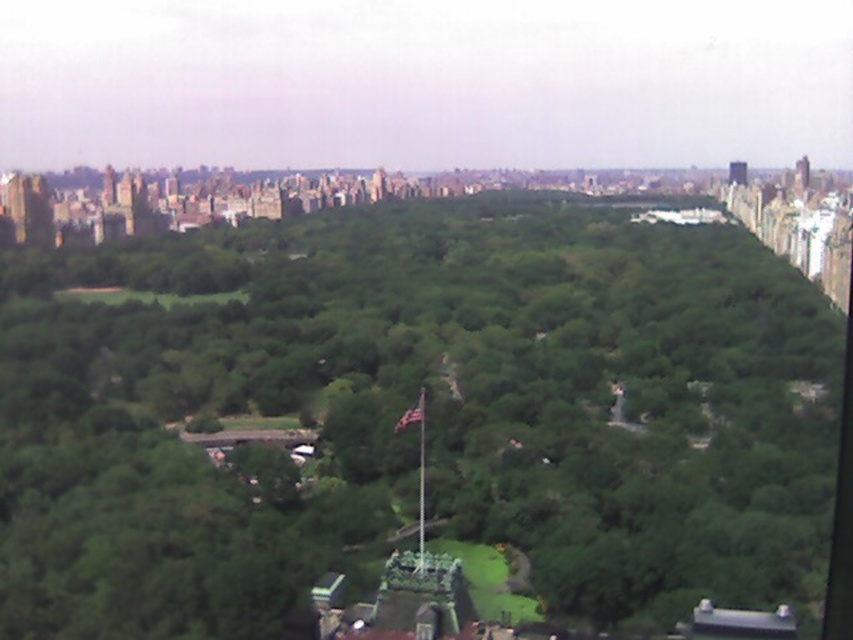
Question: Can you confirm if dark gray stone tower at upper right is positioned below smooth glass tower at upper right?

Choices:
 (A) no
 (B) yes

Answer: (A)

Question: Can you confirm if dark gray stone tower at upper right is positioned below smooth glass tower at upper right?

Choices:
 (A) yes
 (B) no

Answer: (B)

Question: Which object is closer to the camera taking this photo?

Choices:
 (A) green leafy trees at center
 (B) dark gray stone tower at upper right
 (C) smooth glass tower at upper right

Answer: (A)

Question: Which object is farther from the camera taking this photo?

Choices:
 (A) dark gray stone tower at upper right
 (B) green leafy trees at center
 (C) smooth glass tower at upper right

Answer: (A)

Question: Is dark gray stone tower at upper right to the left of smooth glass tower at upper right from the viewer's perspective?

Choices:
 (A) yes
 (B) no

Answer: (B)

Question: Among these points, which one is farthest from the camera?

Choices:
 (A) (793, 177)
 (B) (772, 502)
 (C) (730, 164)

Answer: (A)